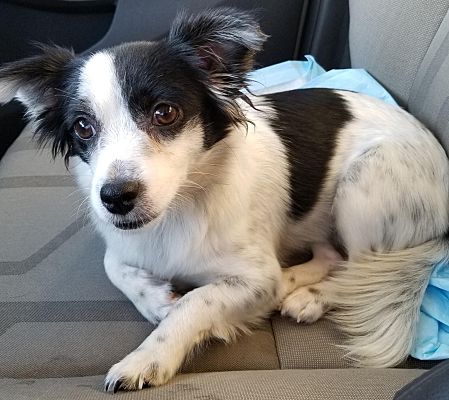
At what (x,y) coordinates should I click in order to perform the action: click on seat stain. Please return your answer as a coordinate pair (x, y). Looking at the image, I should click on (29, 381).